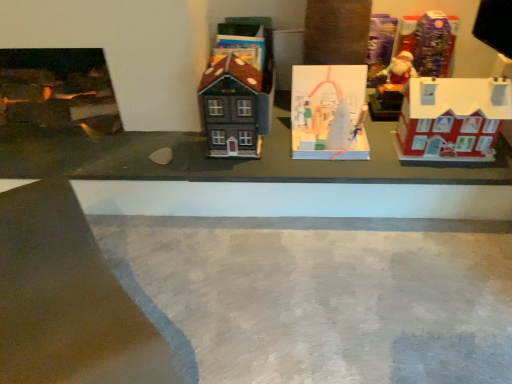
Question: Considering the positions of shiny plastic santa at upper right, which appears as the 5th toy when viewed from the left, and matte brown house at center, placed as the fifth toy when sorted from right to left, in the image, is shiny plastic santa at upper right, which appears as the 5th toy when viewed from the left, wider or thinner than matte brown house at center, placed as the fifth toy when sorted from right to left,?

Choices:
 (A) thin
 (B) wide

Answer: (A)

Question: From the image's perspective, is shiny plastic santa at upper right, which appears as the 5th toy when viewed from the left, positioned above or below matte brown house at center, placed as the fifth toy when sorted from right to left?

Choices:
 (A) above
 (B) below

Answer: (A)

Question: Based on their relative distances, which object is farther from the gray concrete at center?

Choices:
 (A) shiny plastic santa at upper right, marked as the 1th toy in a right-to-left arrangement
 (B) matte brown house at center, placed as the fifth toy when sorted from right to left
 (C) matte red house at right, the 4th toy when ordered from left to right
 (D) matte plastic santa at upper right, the third toy from the right
 (E) white paper ornament at center, acting as the second toy starting from the left

Answer: (A)

Question: Which object is the farthest from the matte red house at right, placed as the 2th toy when sorted from right to left?

Choices:
 (A) matte brown house at center, positioned as the first toy in left-to-right order
 (B) shiny plastic santa at upper right, which appears as the 5th toy when viewed from the left
 (C) matte plastic santa at upper right, the third toy from the right
 (D) white paper ornament at center, acting as the second toy starting from the left
 (E) gray concrete at center

Answer: (A)